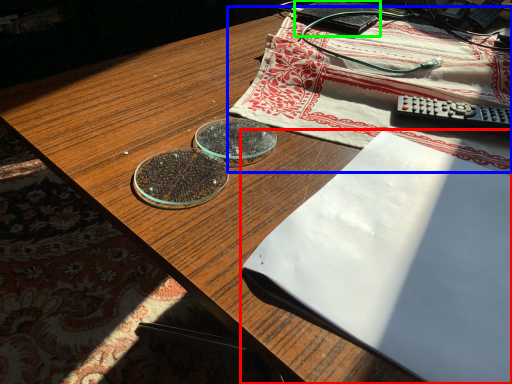
Question: Which object is positioned farthest from notebook (highlighted by a red box)? Select from tablecloth (highlighted by a blue box) and paperback book (highlighted by a green box).

Choices:
 (A) tablecloth
 (B) paperback book

Answer: (B)